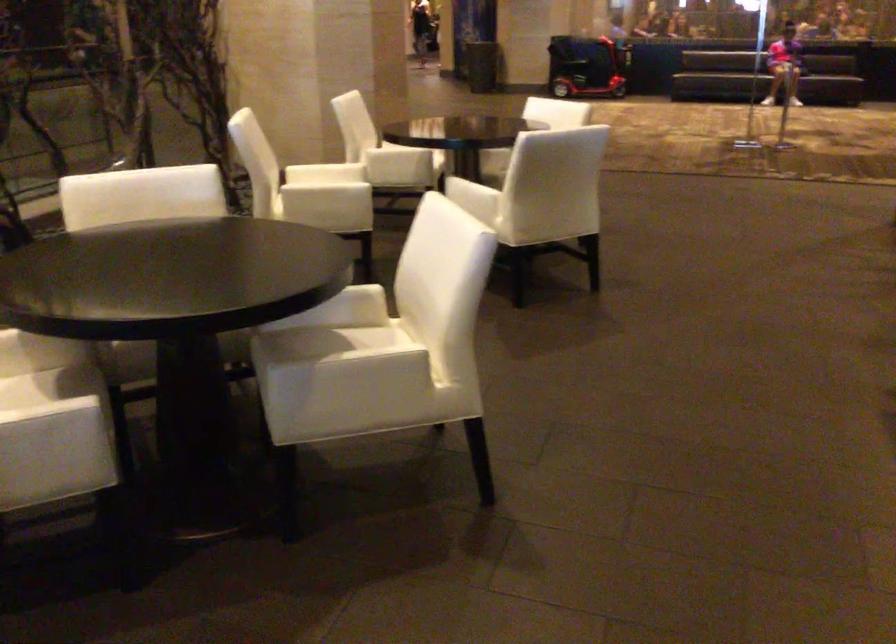
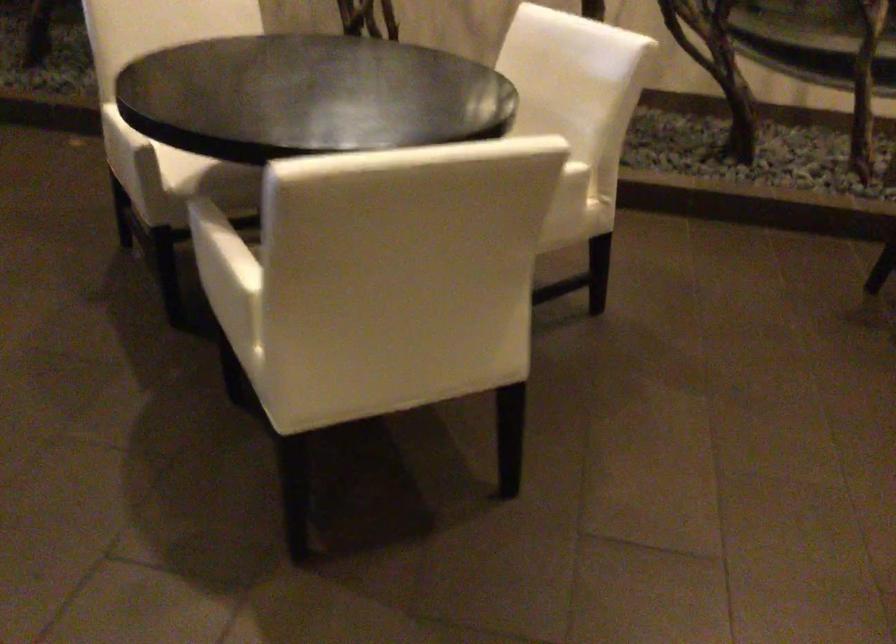
Locate, in the second image, the point that corresponds to the point at 366,357 in the first image.

(220, 249)